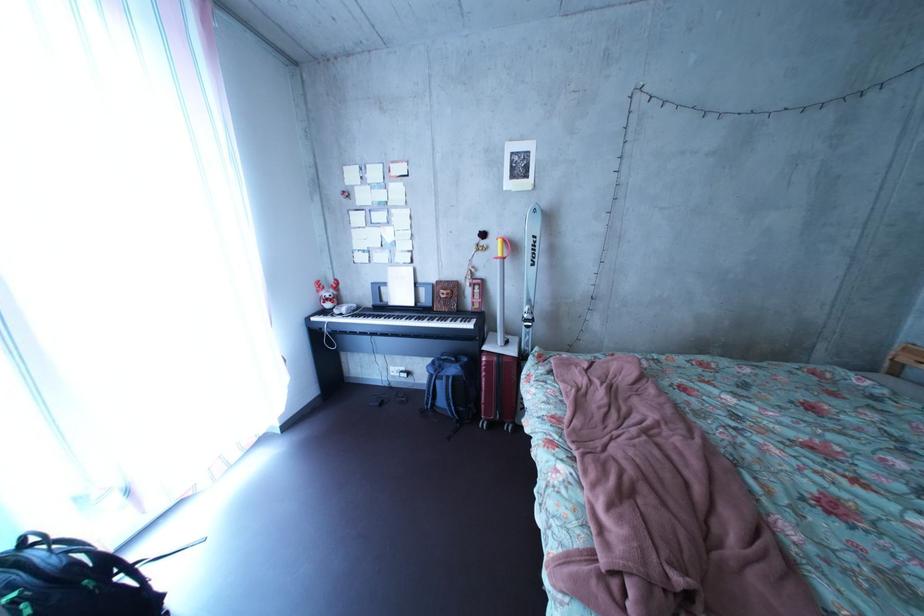
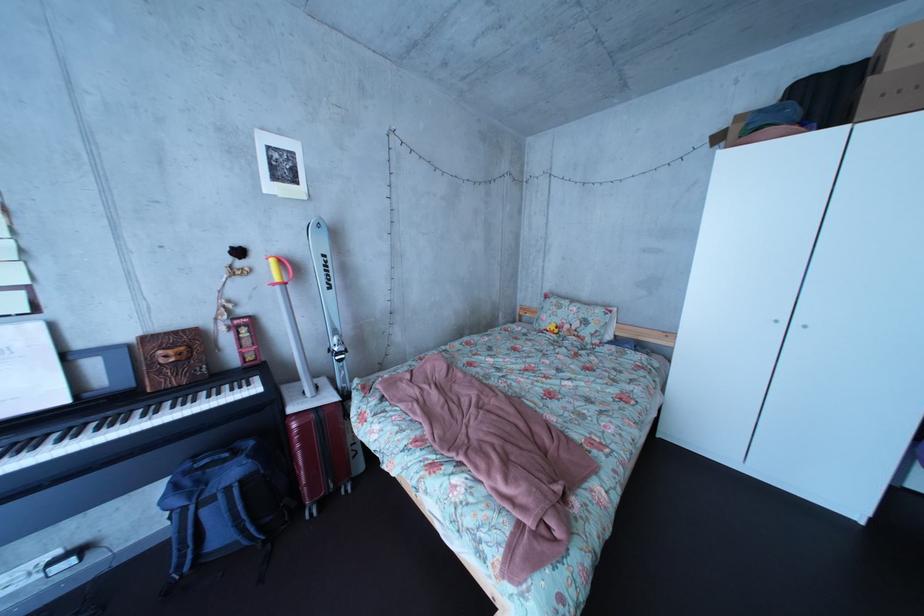
Question: The images are taken continuously from a first-person perspective. In which direction is your viewpoint rotating?

Choices:
 (A) Left
 (B) Right
 (C) Up
 (D) Down

Answer: (B)